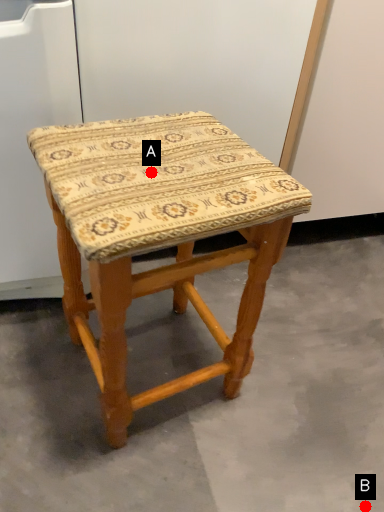
Question: Two points are circled on the image, labeled by A and B beside each circle. Which point appears closest to the camera in this image?

Choices:
 (A) A is closer
 (B) B is closer

Answer: (A)